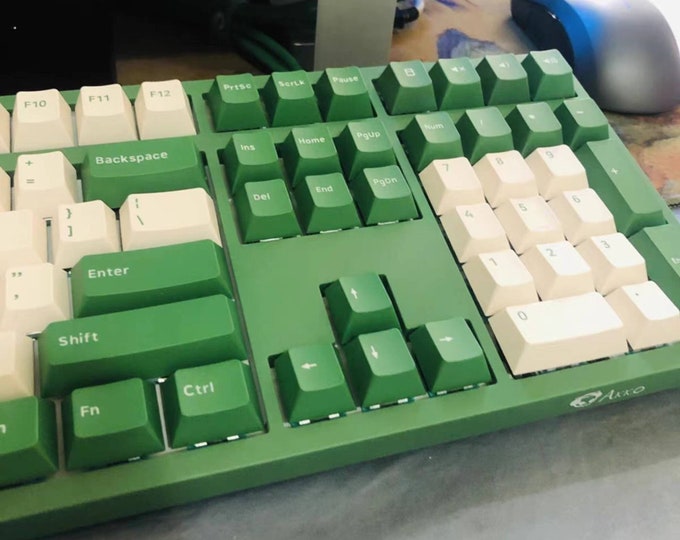
You are a GUI agent. You are given a task and a screenshot of the screen. Output one action in this format:
    pyautogui.click(x=<x>, y=<y>)
    Task: Click on the table
    This screenshot has width=680, height=540.
    Given the screenshot: What is the action you would take?
    pyautogui.click(x=659, y=165)